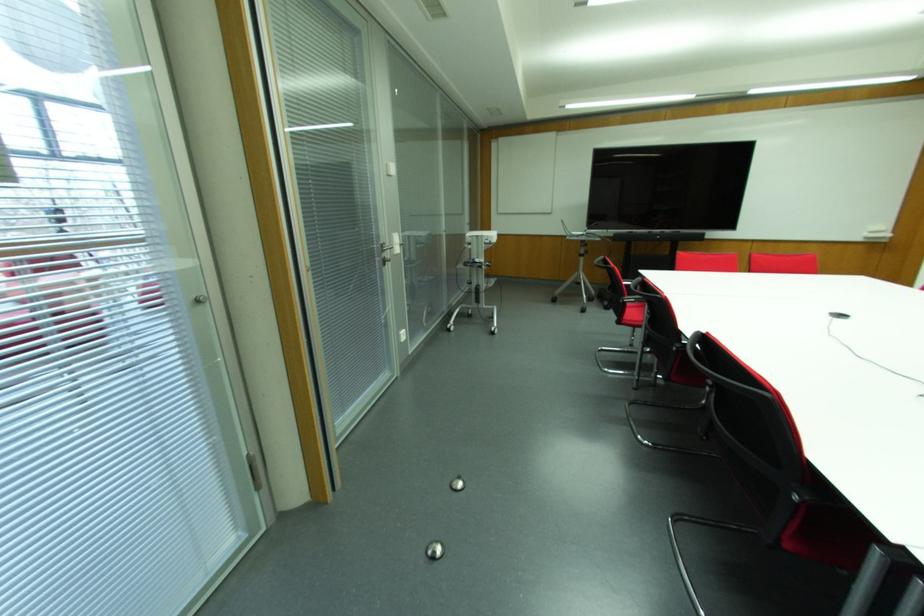
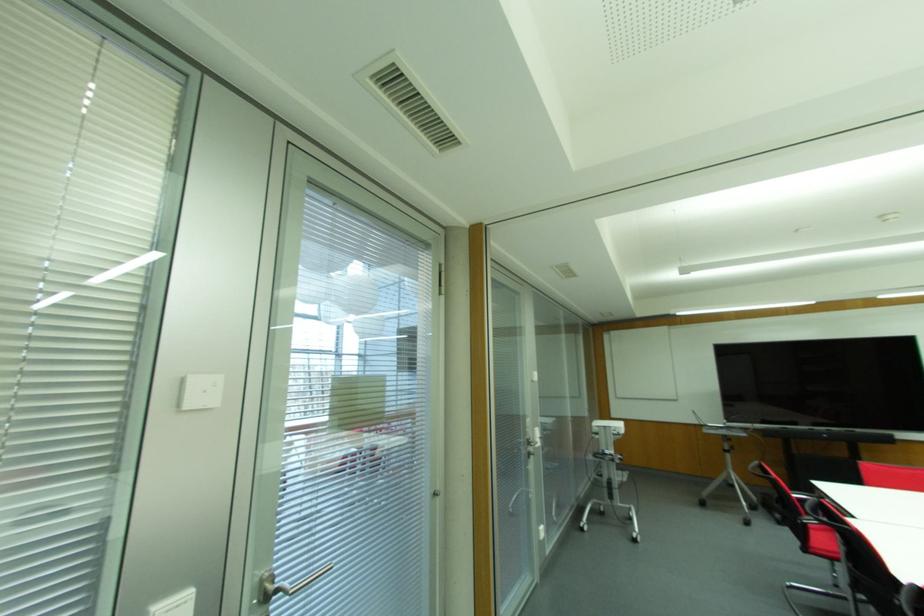
In the second image, find the point that corresponds to the point at 447,330 in the first image.

(581, 529)